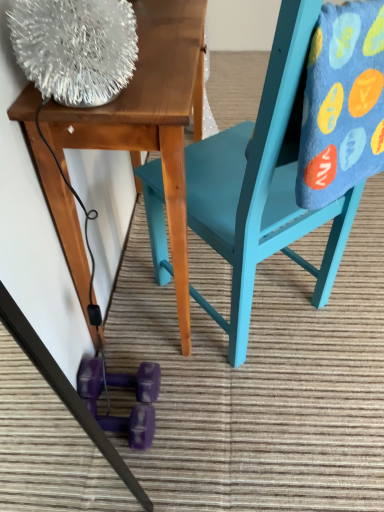
Question: Considering the positions of purple rubber dumbbell at lower center and wooden table at upper left in the image, is purple rubber dumbbell at lower center wider or thinner than wooden table at upper left?

Choices:
 (A) wide
 (B) thin

Answer: (B)

Question: Is purple rubber dumbbell at lower center in front of or behind wooden table at upper left in the image?

Choices:
 (A) front
 (B) behind

Answer: (B)

Question: Which object is positioned farthest from the blue fuzzy blanket at upper right?

Choices:
 (A) wooden table at upper left
 (B) teal painted wood chair at center
 (C) purple rubber dumbbell at lower center

Answer: (C)

Question: Which object is the closest to the wooden table at upper left?

Choices:
 (A) teal painted wood chair at center
 (B) blue fuzzy blanket at upper right
 (C) purple rubber dumbbell at lower center

Answer: (A)